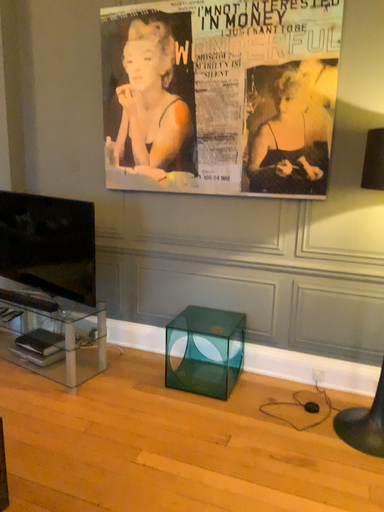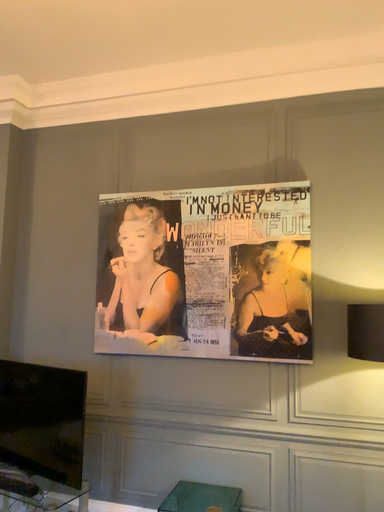
Question: How did the camera likely rotate when shooting the video?

Choices:
 (A) rotated downward
 (B) rotated upward

Answer: (B)